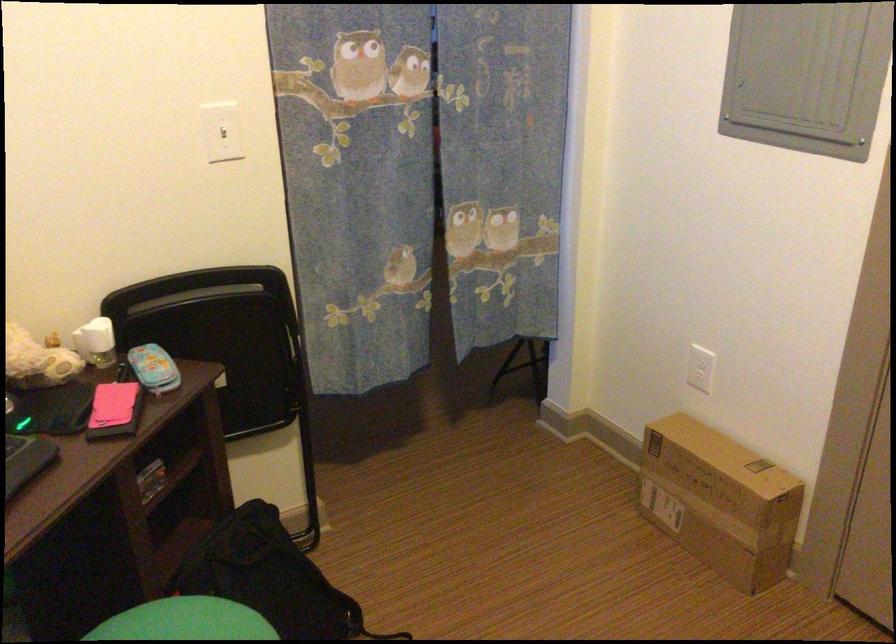
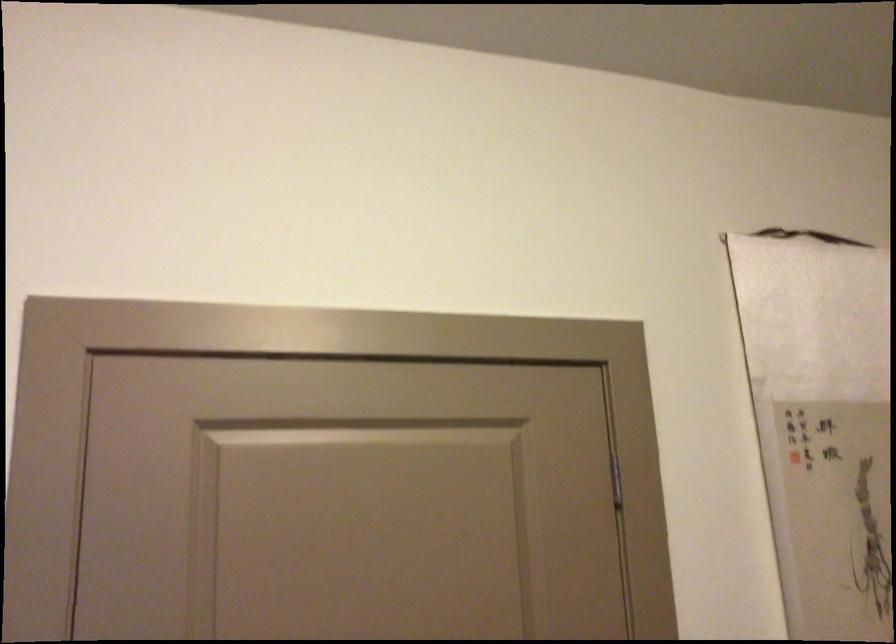
Consider the image. The first image is from the beginning of the video and the second image is from the end. How did the camera likely rotate when shooting the video?

The rotation direction of the camera is right-up.